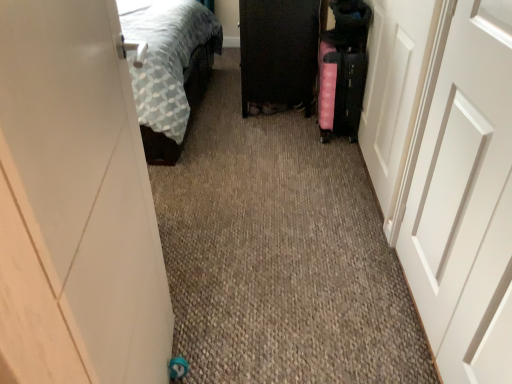
This screenshot has height=384, width=512. What are the coordinates of `vacant space in front of white glossy door at right, which appears as the 1th door when viewed from the right` in the screenshot? It's located at (332, 243).